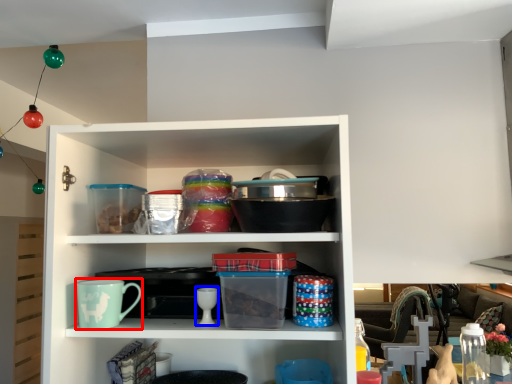
Question: Which object is further to the camera taking this photo, mug (highlighted by a red box) or tableware (highlighted by a blue box)?

Choices:
 (A) mug
 (B) tableware

Answer: (B)